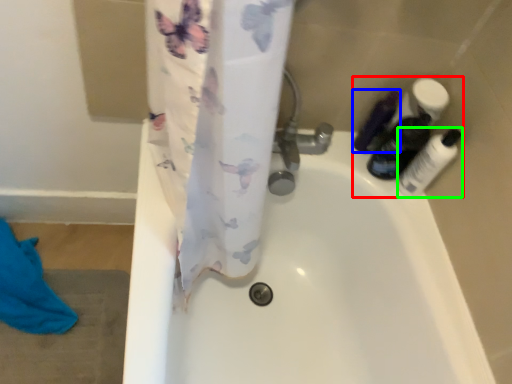
Question: Which object is the closest to the toiletry (highlighted by a red box)? Choose among these: toiletry (highlighted by a blue box) or toiletry (highlighted by a green box).

Choices:
 (A) toiletry
 (B) toiletry

Answer: (B)